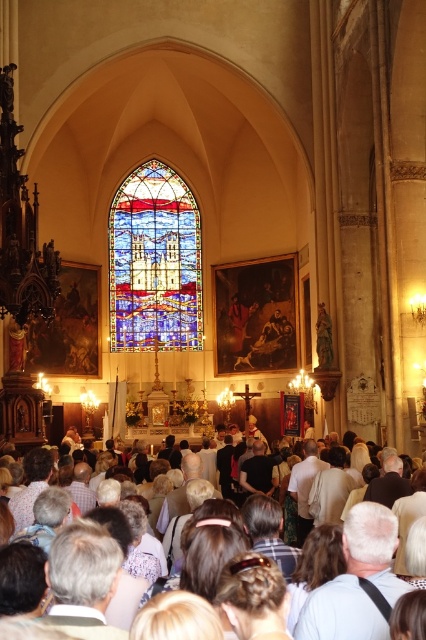
Question: Which object is closer to the camera taking this photo?

Choices:
 (A) white clothed crowd at center
 (B) stained glass window at center

Answer: (A)

Question: Which point is closer to the camera?

Choices:
 (A) (371, 595)
 (B) (187, 285)

Answer: (A)

Question: Can you confirm if stained glass window at center is positioned to the left of white clothed crowd at center?

Choices:
 (A) yes
 (B) no

Answer: (A)

Question: Can you confirm if stained glass window at center is positioned above white clothed crowd at center?

Choices:
 (A) yes
 (B) no

Answer: (A)

Question: Does stained glass window at center have a smaller size compared to white clothed crowd at center?

Choices:
 (A) yes
 (B) no

Answer: (B)

Question: Which of the following is the farthest from the observer?

Choices:
 (A) white clothed crowd at center
 (B) stained glass window at center

Answer: (B)